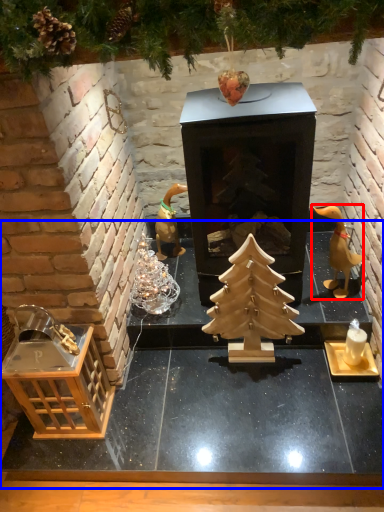
Question: Which object is further to the camera taking this photo, toy (highlighted by a red box) or table (highlighted by a blue box)?

Choices:
 (A) toy
 (B) table

Answer: (A)